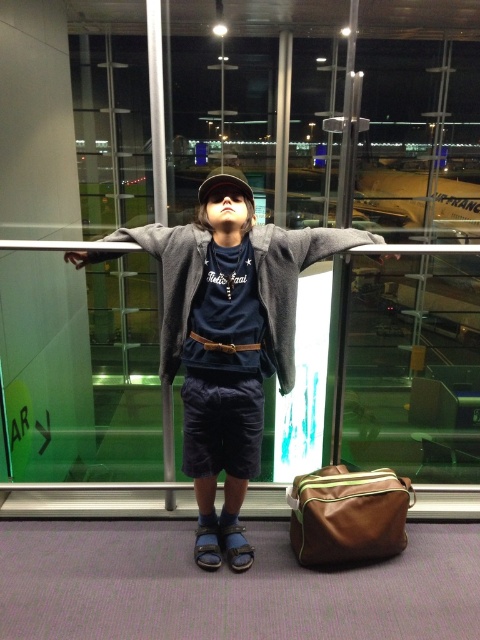
Question: Can you confirm if matte gray hoodie at center is positioned to the left of brown leather belt at center?

Choices:
 (A) yes
 (B) no

Answer: (A)

Question: Is matte gray hoodie at center below brown leather belt at center?

Choices:
 (A) no
 (B) yes

Answer: (B)

Question: Which object is the closest to the brown leather bag at lower right?

Choices:
 (A) brown leather belt at center
 (B) matte gray hoodie at center

Answer: (B)

Question: Estimate the real-world distances between objects in this image. Which object is farther from the matte gray hoodie at center?

Choices:
 (A) brown leather bag at lower right
 (B) brown leather belt at center

Answer: (A)

Question: Among these objects, which one is farthest from the camera?

Choices:
 (A) brown leather belt at center
 (B) brown leather bag at lower right

Answer: (B)

Question: Is brown leather bag at lower right positioned behind brown leather belt at center?

Choices:
 (A) no
 (B) yes

Answer: (B)